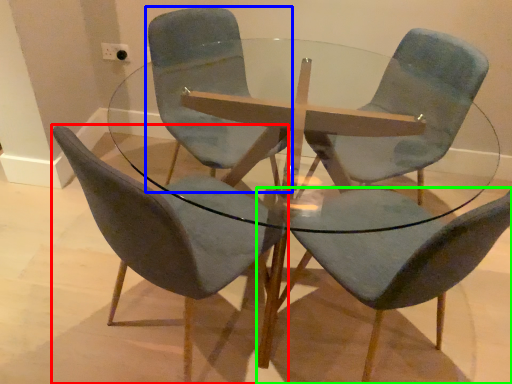
Question: Which is nearer to the chair (highlighted by a red box)? chair (highlighted by a blue box) or chair (highlighted by a green box).

Choices:
 (A) chair
 (B) chair

Answer: (B)